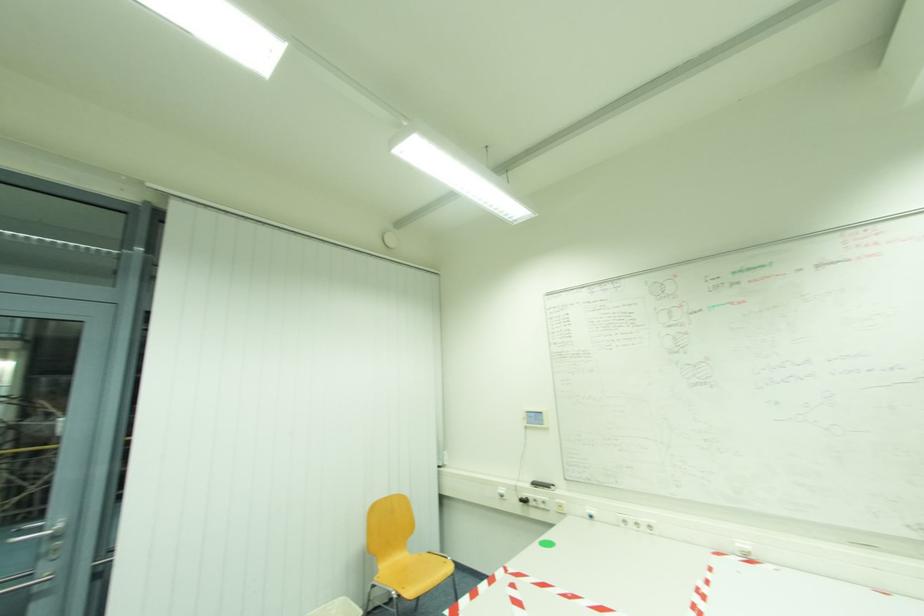
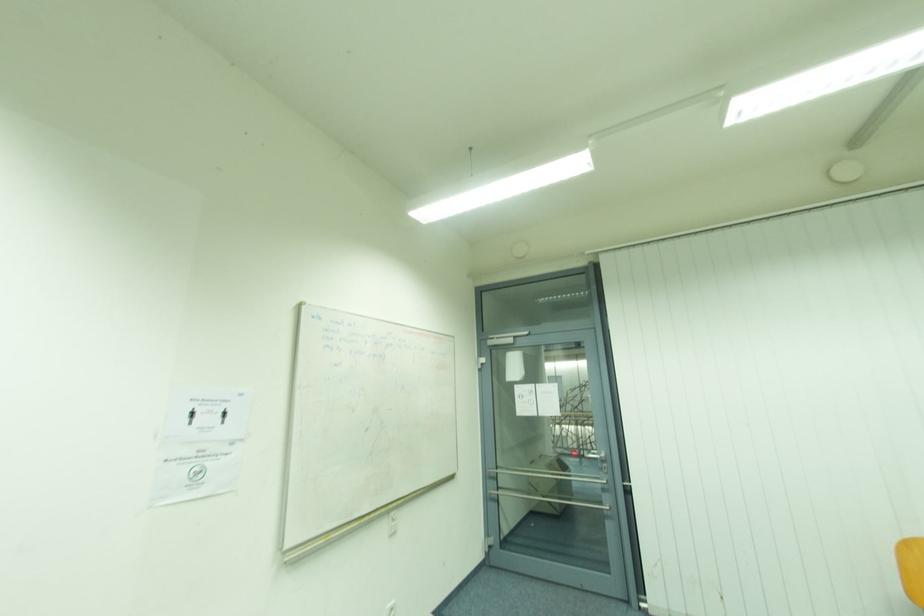
Question: Based on the continuous images, in which direction is the camera rotating? Reply with the corresponding letter.

Choices:
 (A) Left
 (B) Right
 (C) Up
 (D) Down

Answer: (A)